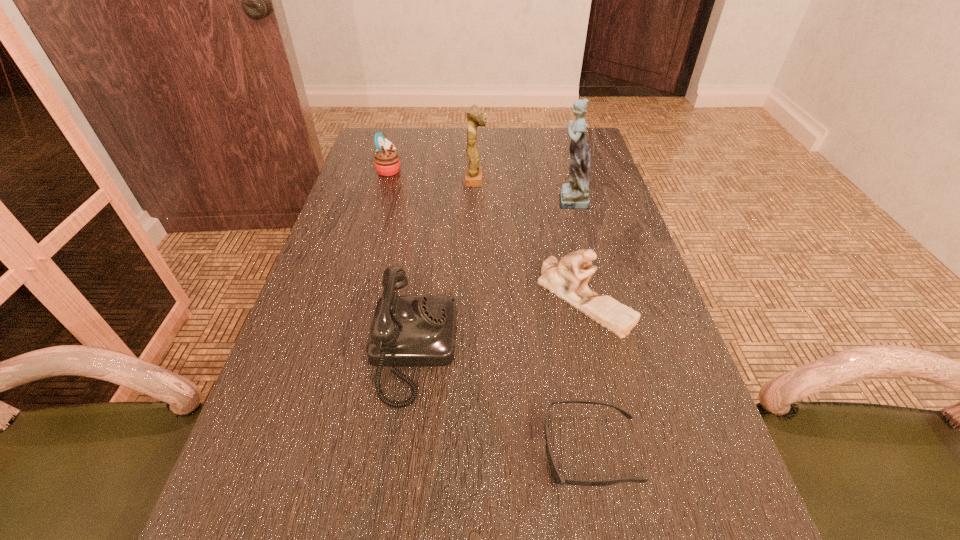
Locate an element on the screen. figurine identified as the closest to the third farthest object is located at coordinates (473, 174).

What are the coordinates of `vacant space that satisfies the following two spatial constraints: 1. on the front-facing side of the shortest figurine; 2. on the dial of the second object from left to right` in the screenshot? It's located at (596, 349).

Identify the location of vacant space that satisfies the following two spatial constraints: 1. on the front-facing side of the shortest figurine; 2. on the front-facing side of the shortest object. (619, 450).